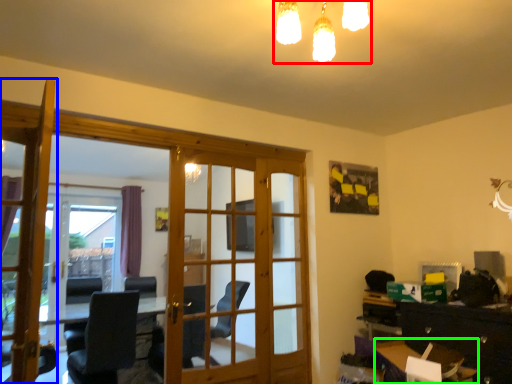
Question: Which object is the closest to the light fixture (highlighted by a red box)? Choose among these: door (highlighted by a blue box) or table (highlighted by a green box).

Choices:
 (A) door
 (B) table

Answer: (A)